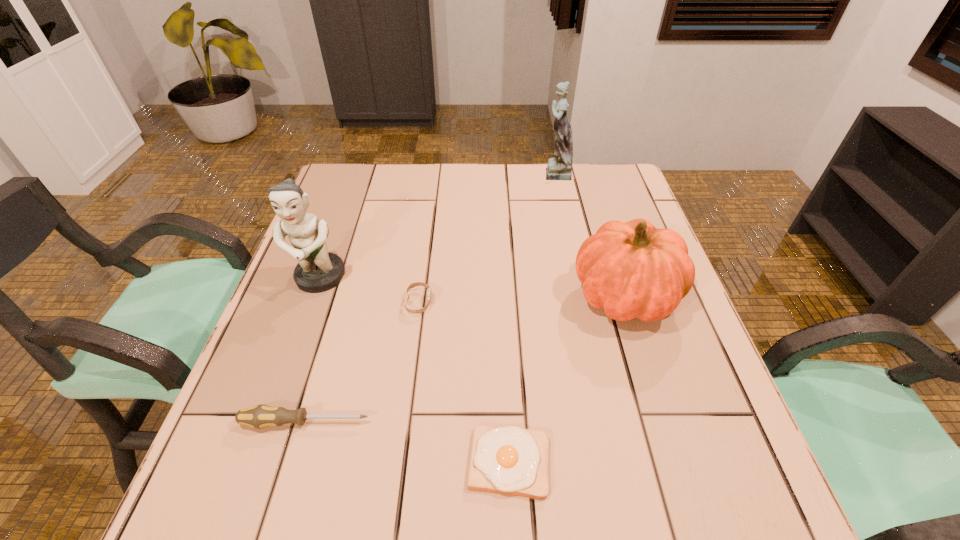
Locate an element on the screen. free spot between the shortest object and the watch is located at coordinates (464, 382).

Identify the location of empty space that is in between the pumpkin and the right figurine. (589, 234).

The height and width of the screenshot is (540, 960). Find the location of `vacant space that is in between the nearer figurine and the fourth object from right to left`. vacant space that is in between the nearer figurine and the fourth object from right to left is located at coordinates (370, 291).

You are a GUI agent. You are given a task and a screenshot of the screen. Output one action in this format:
    pyautogui.click(x=<x>, y=<y>)
    Task: Click on the object that is the closest to the farthest object
    
    Given the screenshot: What is the action you would take?
    pyautogui.click(x=632, y=270)

Where is `object that is the third nearest to the nearer figurine`? The image size is (960, 540). object that is the third nearest to the nearer figurine is located at coordinates (511, 460).

Identify the location of free region that satisfies the following two spatial constraints: 1. on the front side of the pumpkin; 2. at the tip of the screwdriver. The width and height of the screenshot is (960, 540). (664, 422).

Where is `vacant area that satisfies the following two spatial constraints: 1. on the front-facing side of the pumpkin; 2. on the left side of the nearer figurine`? vacant area that satisfies the following two spatial constraints: 1. on the front-facing side of the pumpkin; 2. on the left side of the nearer figurine is located at coordinates (314, 295).

Locate an element on the screen. free space in the image that satisfies the following two spatial constraints: 1. on the face of the fourth object from right to left; 2. on the back side of the shortest object is located at coordinates (397, 462).

Find the location of a particular element. The width and height of the screenshot is (960, 540). free space that satisfies the following two spatial constraints: 1. on the front side of the fourth shortest object; 2. on the face of the watch is located at coordinates (627, 302).

What are the coordinates of `free space that satisfies the following two spatial constraints: 1. on the front-facing side of the pumpkin; 2. on the left side of the right figurine` in the screenshot? It's located at (582, 295).